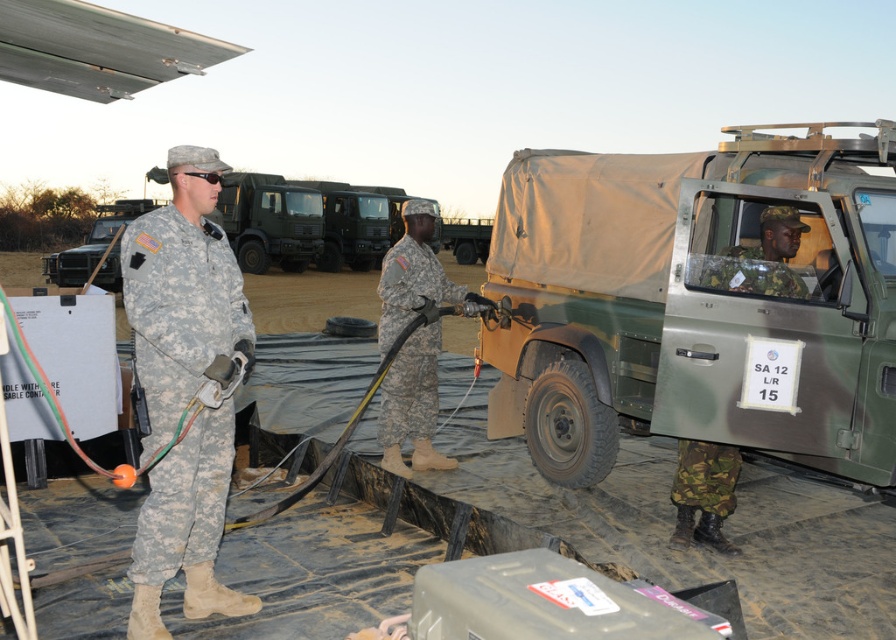
Who is positioned more to the right, green matte truck at center or camouflage fabric uniform at left?

green matte truck at center

Can you confirm if green matte truck at center is taller than camouflage fabric uniform at left?

Indeed, green matte truck at center has a greater height compared to camouflage fabric uniform at left.

Locate an element on the screen. green matte truck at center is located at coordinates (698, 301).

Locate an element on the screen. This screenshot has height=640, width=896. green matte truck at center is located at coordinates (698, 301).

Does camouflage fabric uniform at right lie behind camouflage fabric uniform at center?

That is False.

Describe the element at coordinates (759, 259) in the screenshot. I see `camouflage fabric uniform at right` at that location.

Locate an element on the screen. This screenshot has height=640, width=896. camouflage fabric uniform at right is located at coordinates (759, 259).

The width and height of the screenshot is (896, 640). What are the coordinates of `camouflage fabric uniform at right` in the screenshot? It's located at (759, 259).

Between green matte truck at center and camouflage fabric uniform at center, which one is positioned lower?

camouflage fabric uniform at center

Who is taller, green matte truck at center or camouflage fabric uniform at center?

green matte truck at center is taller.

Locate an element on the screen. green matte truck at center is located at coordinates (698, 301).

This screenshot has width=896, height=640. What are the coordinates of `green matte truck at center` in the screenshot? It's located at (698, 301).